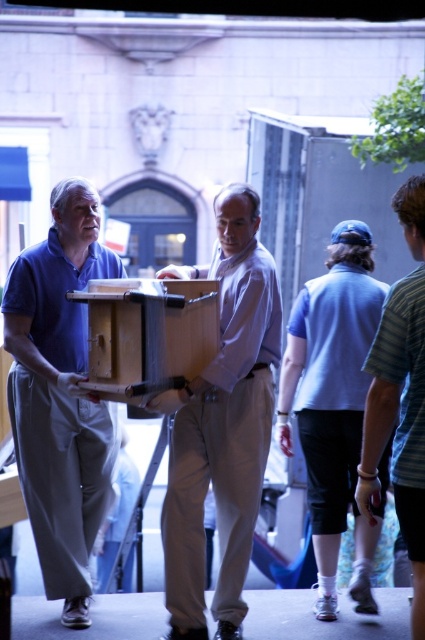
You are an observer watching two people carrying a box on a stage. You see the light brown wood box at center and the light blue shirt at center. Which object is positioned higher from the ground?

The light blue shirt at center is positioned higher from the ground than the light brown wood box at center because the box is located below the shirt.